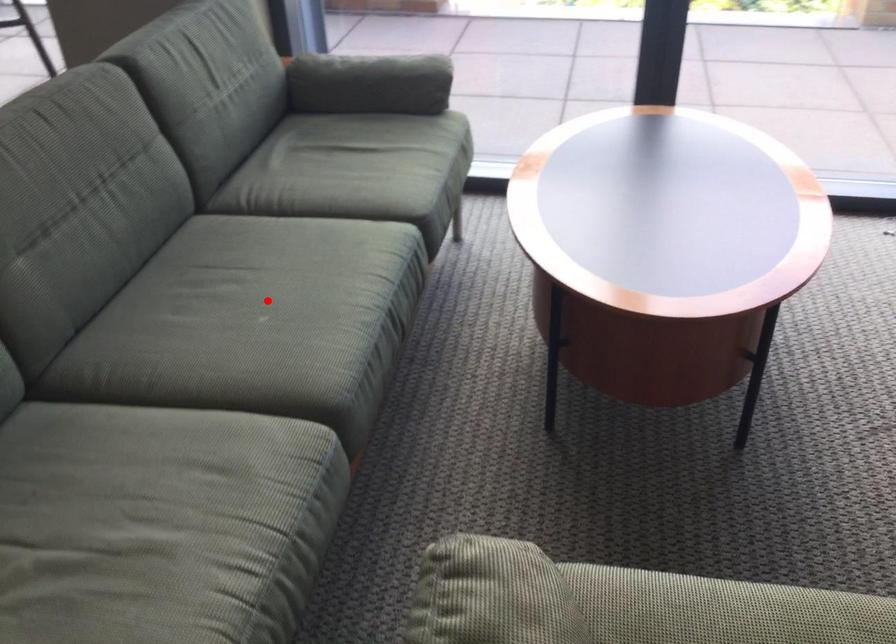
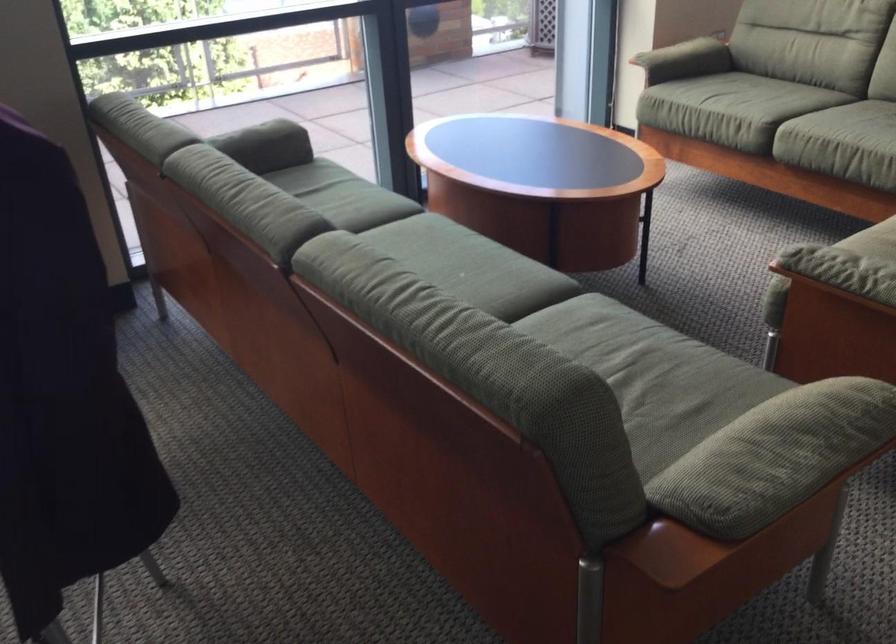
In the second image, find the point that corresponds to the highlighted location in the first image.

(442, 267)